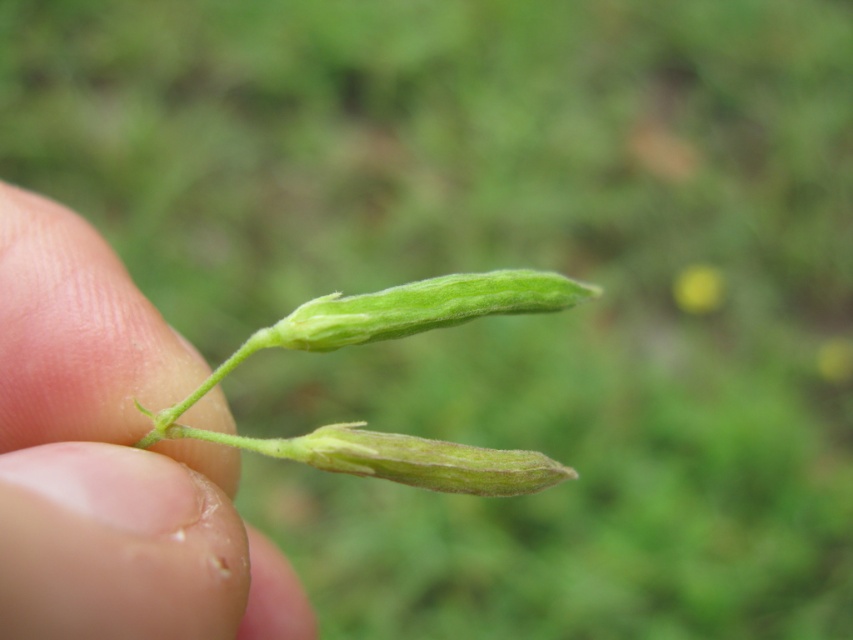
You are a botanist examining a plant specimen. You need to locate the green matte pod at center in the image. What are its coordinates?

The green matte pod at center is located at coordinates point (112, 460).